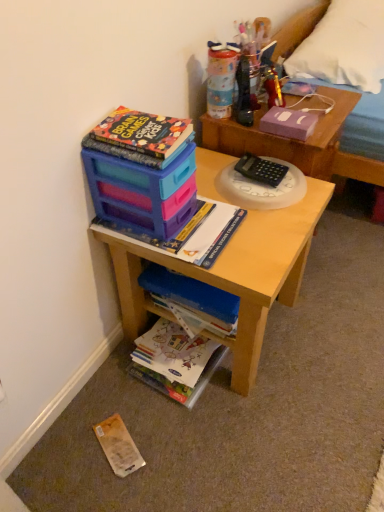
Find the location of `vacant space in front of yellow paper at lower left, arranged as the first paperback book when ordered from the bottom`. vacant space in front of yellow paper at lower left, arranged as the first paperback book when ordered from the bottom is located at coordinates (101, 487).